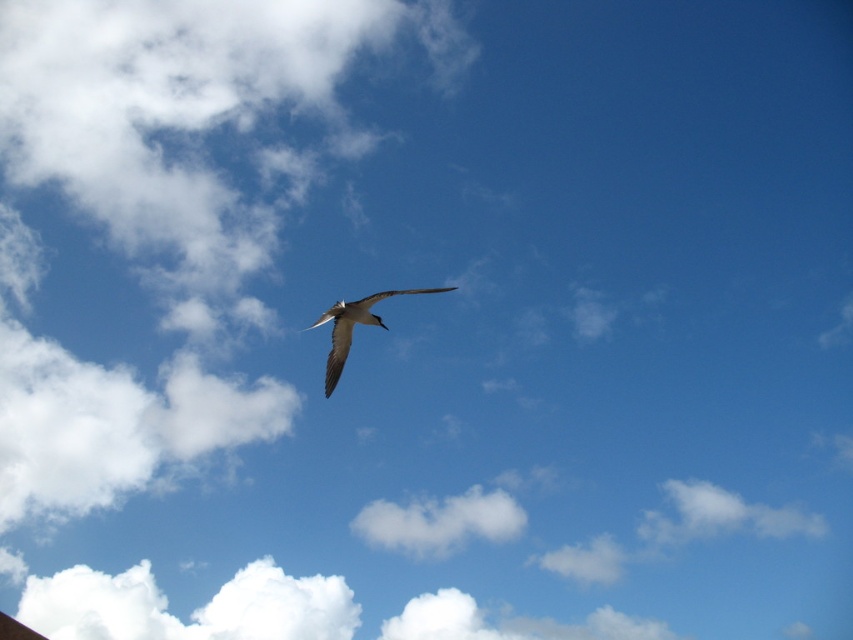
Does white fluffy cloud at center appear on the left side of white feathered bird at center?

No, white fluffy cloud at center is not to the left of white feathered bird at center.

Locate an element on the screen. white fluffy cloud at center is located at coordinates coord(439,522).